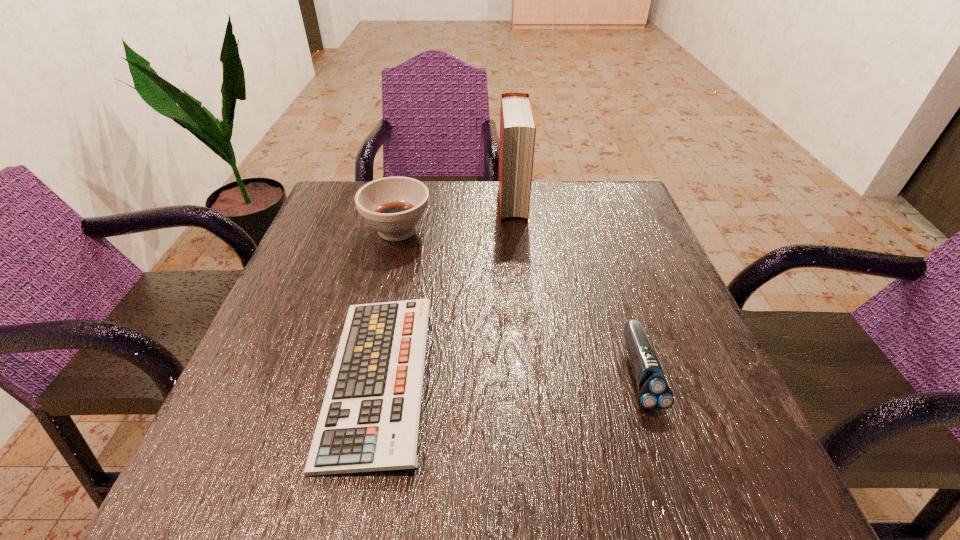
Where is `free space between the soup bowl and the second shortest object`? The image size is (960, 540). free space between the soup bowl and the second shortest object is located at coordinates (518, 301).

Where is `vacant space that is in between the rightmost object and the shortest object`? vacant space that is in between the rightmost object and the shortest object is located at coordinates (509, 375).

This screenshot has height=540, width=960. Identify the location of empty space between the third tallest object and the tallest object. (576, 287).

Find the location of a particular element. The image size is (960, 540). the third closest object relative to the hardback book is located at coordinates (654, 394).

Identify which object is the second nearest to the rightmost object. Please provide its 2D coordinates. Your answer should be formatted as a tuple, i.e. [(x, y)], where the tuple contains the x and y coordinates of a point satisfying the conditions above.

[(517, 121)]